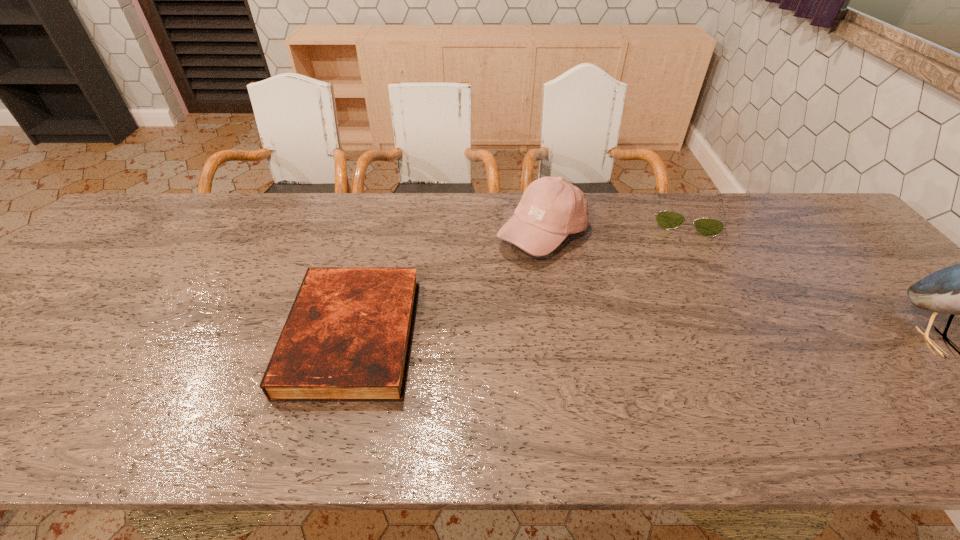
The height and width of the screenshot is (540, 960). Find the location of `vacant space on the desktop that is between the Bible and the tallest object and is positioned on the front-facing side of the baseball cap`. vacant space on the desktop that is between the Bible and the tallest object and is positioned on the front-facing side of the baseball cap is located at coordinates (608, 338).

Locate an element on the screen. Image resolution: width=960 pixels, height=540 pixels. free space on the desktop that is between the leftmost object and the rightmost object and is positioned on the front-facing side of the third object from left to right is located at coordinates (683, 339).